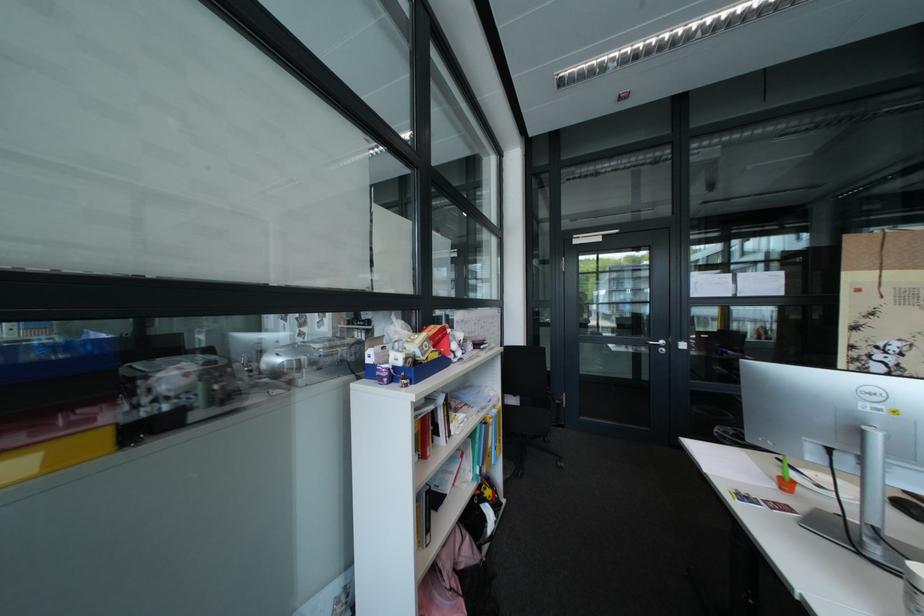
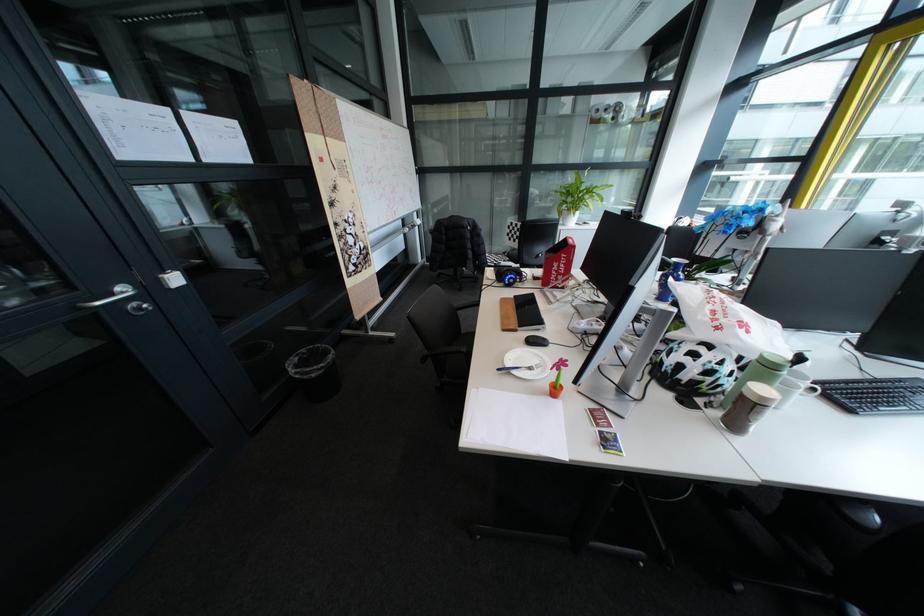
Where in the second image is the point corresponding to point 675,351 from the first image?

(152, 309)